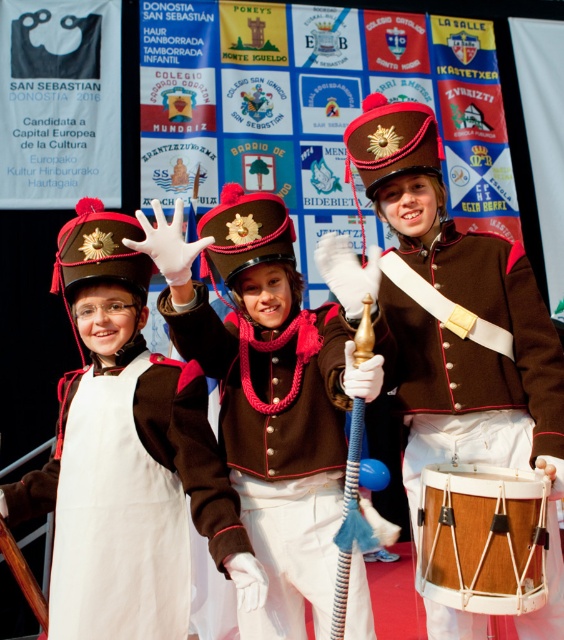
Question: Which of the following is the farthest from the observer?

Choices:
 (A) brown matte uniform at center
 (B) brown woolen jacket at center
 (C) white felt dress at center

Answer: (C)

Question: Observing the image, what is the correct spatial positioning of brown matte uniform at center in reference to wooden drum at center?

Choices:
 (A) left
 (B) right

Answer: (A)

Question: Considering the real-world distances, which object is farthest from the wooden drum at center?

Choices:
 (A) brown woolen jacket at center
 (B) white felt dress at center

Answer: (B)

Question: Does brown matte uniform at center appear under white felt dress at center?

Choices:
 (A) yes
 (B) no

Answer: (B)

Question: Does brown woolen jacket at center appear over wooden drum at center?

Choices:
 (A) yes
 (B) no

Answer: (A)

Question: Among these points, which one is nearest to the camera?

Choices:
 (A) (386, 317)
 (B) (41, 470)
 (C) (420, 538)
 (D) (266, 536)

Answer: (C)